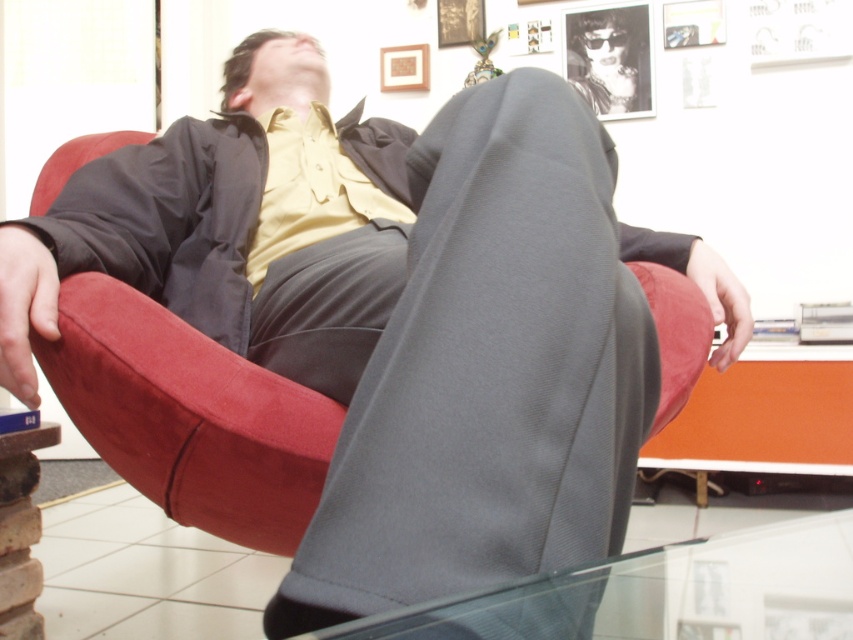
Can you confirm if velvet red bean bag chair at center is positioned to the left of transparent glass table at lower center?

Correct, you'll find velvet red bean bag chair at center to the left of transparent glass table at lower center.

Can you confirm if velvet red bean bag chair at center is smaller than transparent glass table at lower center?

Yes, velvet red bean bag chair at center is smaller than transparent glass table at lower center.

Between point (79, 376) and point (419, 621), which one is positioned behind?

The point (79, 376) is more distant.

You are a GUI agent. You are given a task and a screenshot of the screen. Output one action in this format:
    pyautogui.click(x=<x>, y=<y>)
    Task: Click on the velvet red bean bag chair at center
    This screenshot has height=640, width=853.
    Given the screenshot: What is the action you would take?
    pyautogui.click(x=189, y=417)